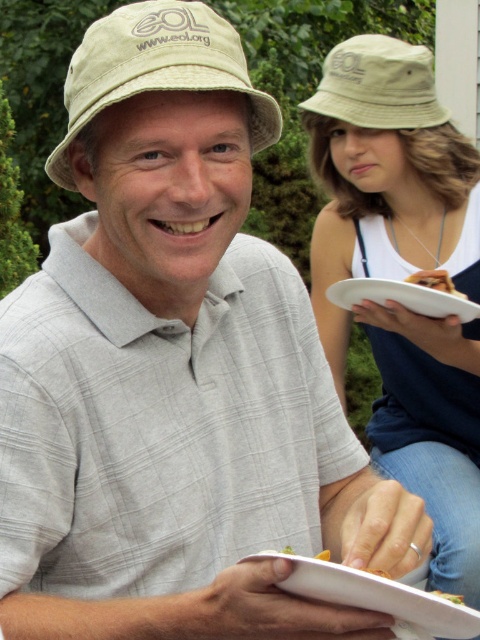
You are at an outdoor event and want to place a new white paper plate exactly where the existing one is located. The existing plate is at point coordinates of (408, 294). Can you confirm if this location is at the center of the image?

Yes, the point coordinates (408, 294) mark the white paper plate at center, so placing the new plate there would position it at the center of the image.

You are organizing a picnic and need to decide which item to place on a small shelf. The shelf can only hold items that are not taller than 10 cm. Based on the scene, can the matte beige bucket hat at upper center and the white paper plate at center both fit on the shelf?

The matte beige bucket hat at upper center is taller than the white paper plate at center. Since the shelf has a height limit of 10 cm, we need to know the exact height of the hat to determine if it fits. However, the description only states the relative height between the two items. Without specific measurements, we cannot confirm if both items meet the shelf height requirement.